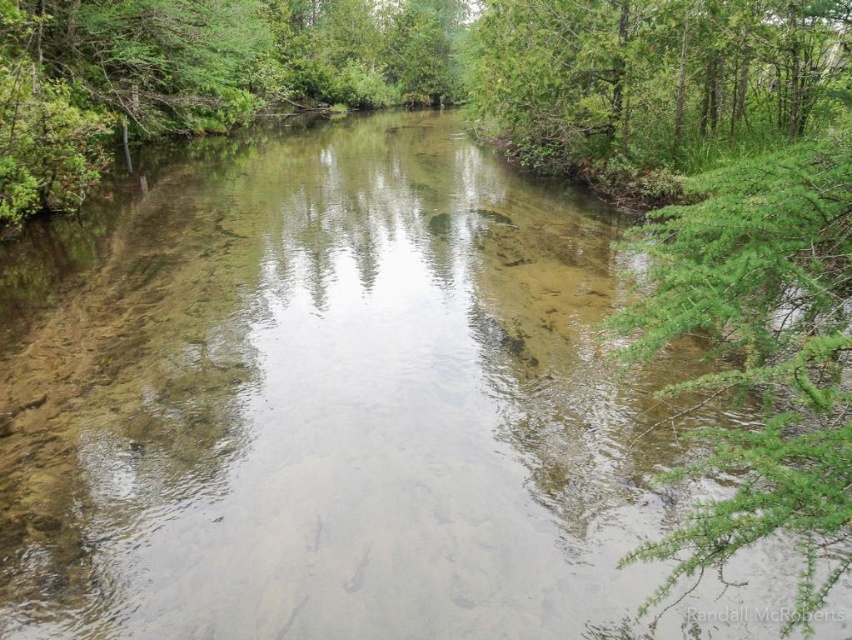
Is point (826, 157) farther from camera compared to point (790, 90)?

No, it is in front of (790, 90).

Locate an element on the screen. This screenshot has width=852, height=640. green leafy branch at right is located at coordinates (x=763, y=353).